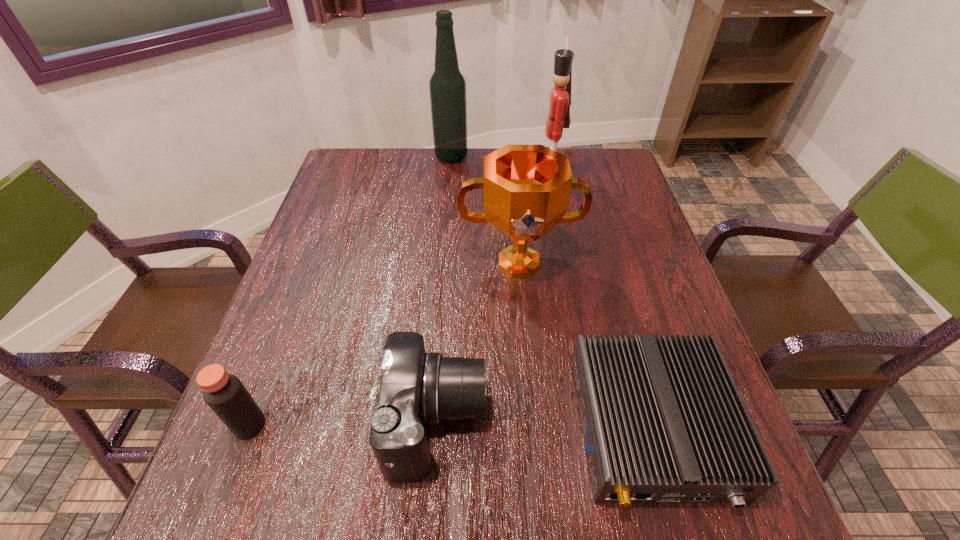
The height and width of the screenshot is (540, 960). I want to click on vacant space located 0.050m on the front-facing side of the second farthest object, so click(516, 179).

Locate an element on the screen. free space located on the side of the fourth nearest object with the star emblem is located at coordinates (532, 411).

The width and height of the screenshot is (960, 540). Identify the location of vacant space located 0.240m on the right of the vinegar. (398, 424).

Where is `free space located on the lens of the camera`? This screenshot has width=960, height=540. free space located on the lens of the camera is located at coordinates (595, 422).

At what (x,y) coordinates should I click in order to perform the action: click on alcohol located in the far edge section of the desktop. Please return your answer as a coordinate pair (x, y). Looking at the image, I should click on (447, 85).

Locate an element on the screen. This screenshot has width=960, height=540. nutcracker present at the far edge is located at coordinates (558, 117).

You are a GUI agent. You are given a task and a screenshot of the screen. Output one action in this format:
    pyautogui.click(x=<x>, y=<y>)
    Task: Click on the camera that is positioned at the near edge
    The width and height of the screenshot is (960, 540).
    Given the screenshot: What is the action you would take?
    pyautogui.click(x=415, y=388)

Identify the location of router present at the near edge. (663, 421).

I want to click on object that is at the left edge, so click(224, 393).

Where is `object that is at the right edge`? Image resolution: width=960 pixels, height=540 pixels. object that is at the right edge is located at coordinates (663, 421).